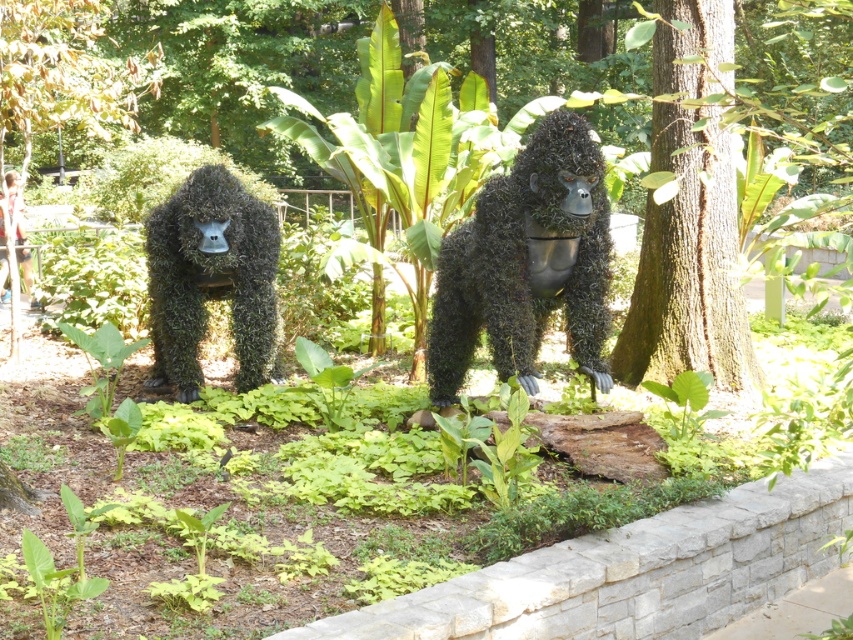
Which is behind, point (555, 236) or point (135, 100)?

Positioned behind is point (135, 100).

Between green mossy gorilla at center and green leafy tree at upper left, which one has more height?

With more height is green leafy tree at upper left.

Who is more distant from viewer, [538,244] or [48,32]?

Point [48,32]

The height and width of the screenshot is (640, 853). I want to click on green mossy gorilla at center, so click(x=527, y=262).

Measure the distance between green rough bark tree at center and camera.

green rough bark tree at center and camera are 7.41 meters apart.

Find the location of a particular element. green rough bark tree at center is located at coordinates (689, 216).

The image size is (853, 640). Identify the location of green rough bark tree at center. (689, 216).

At what (x,y) coordinates should I click in order to perform the action: click on green rough bark tree at center. Please return your answer as a coordinate pair (x, y). Looking at the image, I should click on (689, 216).

Is green mossy gorilla at left shorter than green leafy tree at upper left?

Yes, green mossy gorilla at left is shorter than green leafy tree at upper left.

Is point (200, 256) less distant than point (57, 116)?

Yes, it is in front of point (57, 116).

Image resolution: width=853 pixels, height=640 pixels. In order to click on green mossy gorilla at left in this screenshot , I will do `click(212, 278)`.